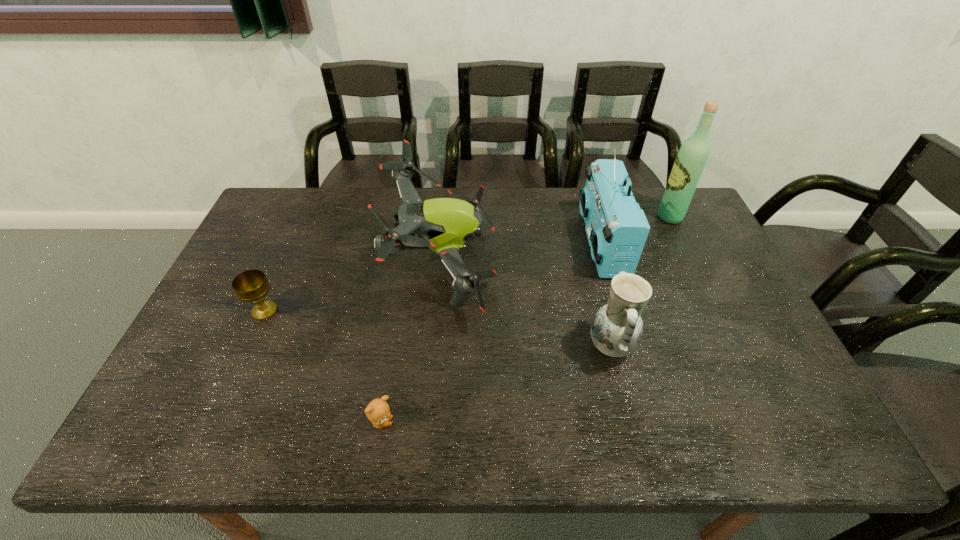
Find the location of a particular element. The image size is (960, 540). free space between the drone and the radio receiver is located at coordinates (522, 253).

This screenshot has width=960, height=540. Find the location of `free space between the drone and the radio receiver`. free space between the drone and the radio receiver is located at coordinates (522, 253).

Select which object appears as the closest to the fourth tallest object. Please provide its 2D coordinates. Your answer should be formatted as a tuple, i.e. [(x, y)], where the tuple contains the x and y coordinates of a point satisfying the conditions above.

[(617, 229)]

Image resolution: width=960 pixels, height=540 pixels. Find the location of `the fifth closest object to the rightmost object`. the fifth closest object to the rightmost object is located at coordinates (250, 286).

In order to click on free location that satisfies the following two spatial constraints: 1. on the front-facing side of the drone; 2. on the front side of the chalice in this screenshot , I will do `click(438, 310)`.